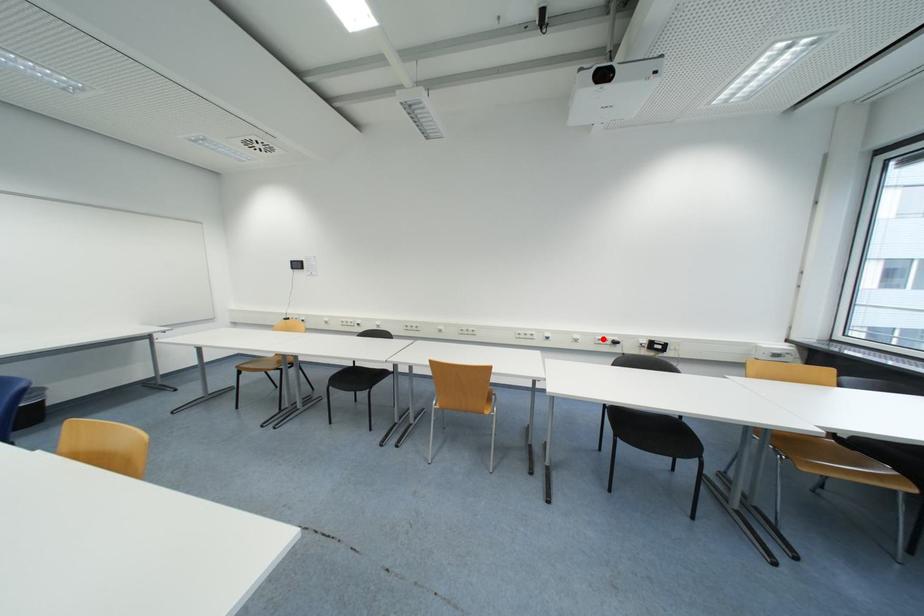
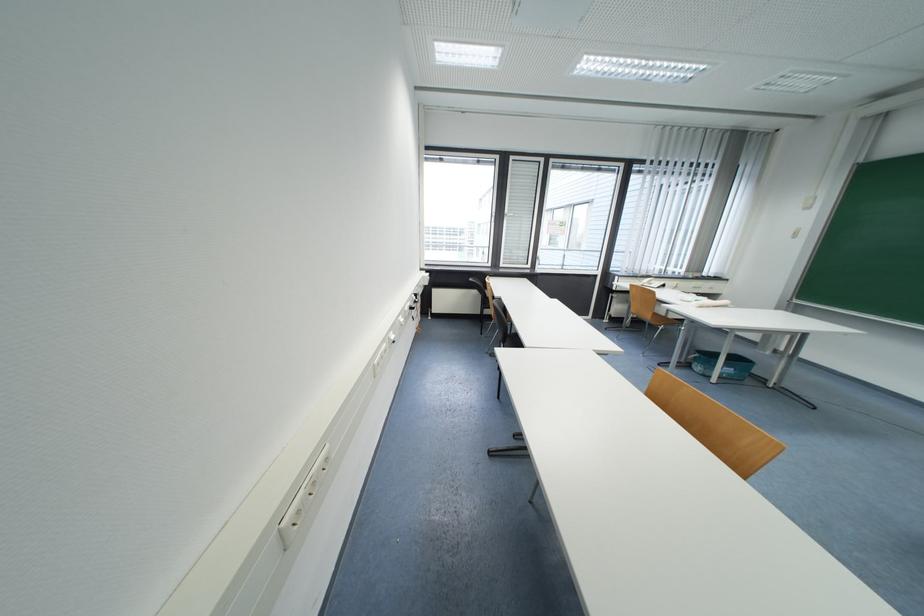
Question: A red point is marked in image1. In image2, is the corresponding 3D point closer to the camera or farther? Reply with the corresponding letter.

Choices:
 (A) The corresponding 3D point is closer.
 (B) The corresponding 3D point is farther.

Answer: (A)